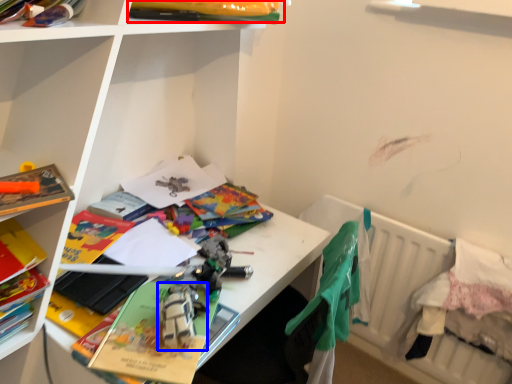
Question: Which of the following is the farthest to the observer, book (highlighted by a red box) or toy (highlighted by a blue box)?

Choices:
 (A) book
 (B) toy

Answer: (A)